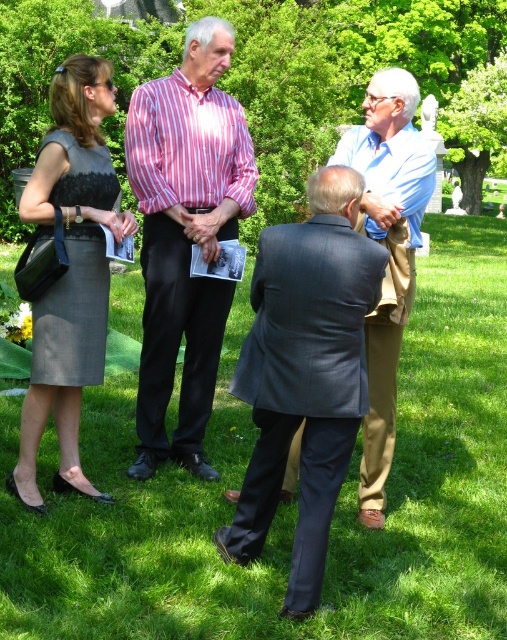
Looking at this image, is matte gray dress at left to the left of light blue shirt at center from the viewer's perspective?

Indeed, matte gray dress at left is positioned on the left side of light blue shirt at center.

Measure the distance between matte gray dress at left and light blue shirt at center.

matte gray dress at left and light blue shirt at center are 6.83 feet apart from each other.

Is point (86, 208) farther from camera compared to point (351, 129)?

No, (86, 208) is in front of (351, 129).

This screenshot has width=507, height=640. What are the coordinates of `matte gray dress at left` in the screenshot? It's located at (69, 272).

Does striped cotton shirt at center have a smaller size compared to light blue shirt at center?

Actually, striped cotton shirt at center might be larger than light blue shirt at center.

Does striped cotton shirt at center appear on the left side of light blue shirt at center?

Yes, striped cotton shirt at center is to the left of light blue shirt at center.

Between point (206, 221) and point (405, 236), which one is positioned behind?

The point (206, 221) is more distant.

The height and width of the screenshot is (640, 507). Find the location of `striped cotton shirt at center`. striped cotton shirt at center is located at coordinates (186, 236).

Does point (8, 467) come farther from viewer compared to point (178, 102)?

No, it is in front of (178, 102).

Is green grass at lower center positioned behind striped cotton shirt at center?

No, green grass at lower center is in front of striped cotton shirt at center.

I want to click on green grass at lower center, so click(293, 502).

Image resolution: width=507 pixels, height=640 pixels. I want to click on green grass at lower center, so click(x=293, y=502).